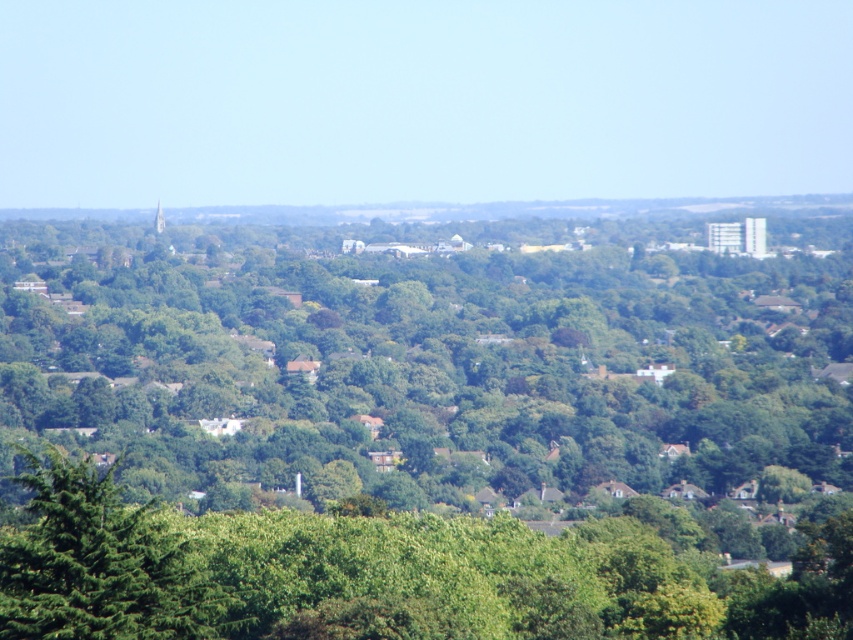
Does green leafy tree at center have a smaller size compared to green leafy tree at lower left?

Actually, green leafy tree at center might be larger than green leafy tree at lower left.

The height and width of the screenshot is (640, 853). Identify the location of green leafy tree at center. (422, 365).

Image resolution: width=853 pixels, height=640 pixels. Identify the location of green leafy tree at center. (422, 365).